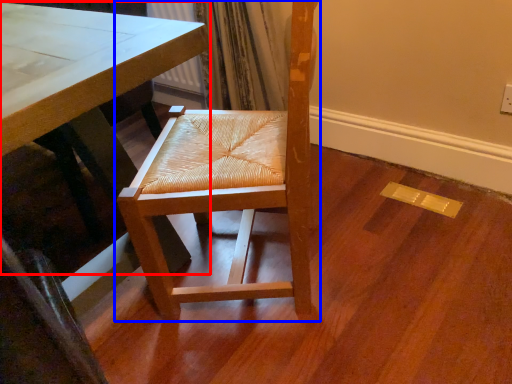
Question: Which object appears farthest to the camera in this image, table (highlighted by a red box) or chair (highlighted by a blue box)?

Choices:
 (A) table
 (B) chair

Answer: (B)